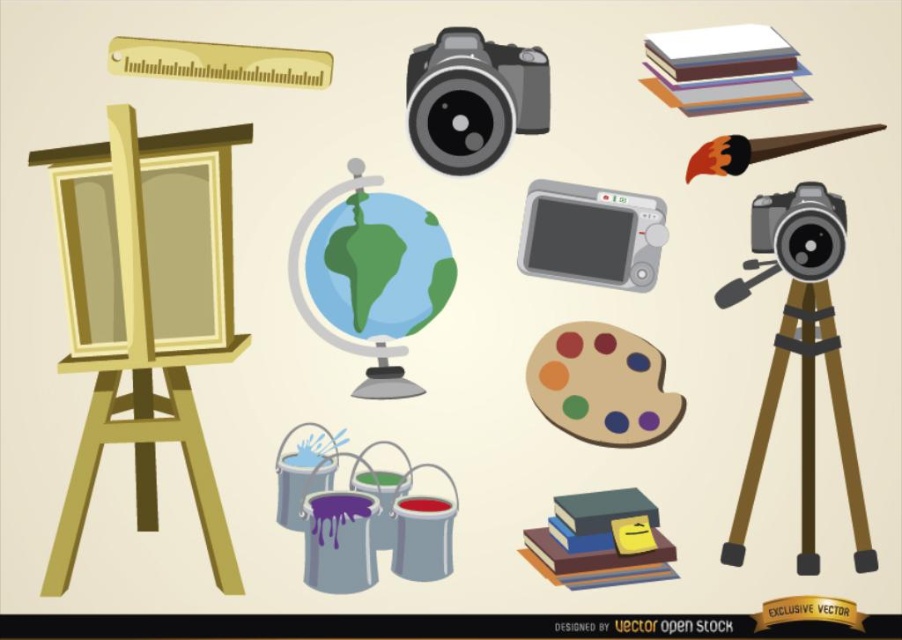
You are standing in front of the art supplies display and need to reach both the point at (656, 358) and the point at (525, 246). Which point should you approach first to touch them in order from closest to farthest?

You should approach point (656, 358) first because it is closer to you than point (525, 246), which is farther away.

You are setting up a photography display and need to arrange the matte black camera at upper center and the gray plastic camera at center. According to the image, which camera should be placed to the left of the other?

The matte black camera at upper center should be placed to the left of the gray plastic camera at center because it is positioned on the left side of it in the image.

You are an art student who wants to take a photo of the globe. You have two cameras available. Which camera, the matte black camera at upper center or the gray plastic camera at center, is closer to the globe?

The matte black camera at upper center is closer to the globe because it is in front of the gray plastic camera at center.